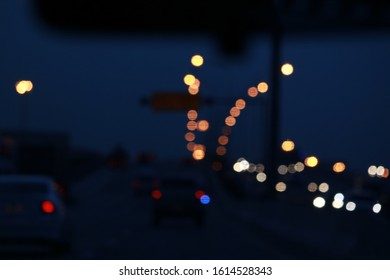
Where is `light`? light is located at coordinates (379, 170).